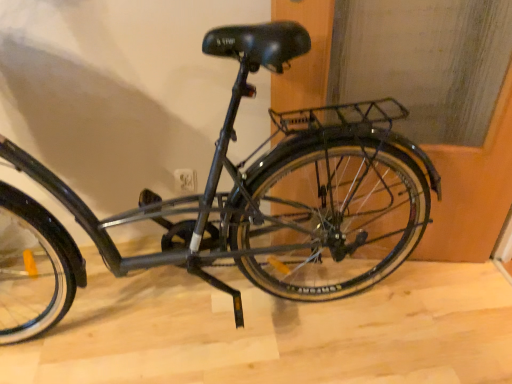
Identify the location of matte black bicycle at center. (282, 191).

What do you see at coordinates (282, 191) in the screenshot? The image size is (512, 384). I see `matte black bicycle at center` at bounding box center [282, 191].

Measure the distance between point (327, 157) and camera.

Point (327, 157) is 4.41 feet from camera.

I want to click on matte black bicycle at center, so click(282, 191).